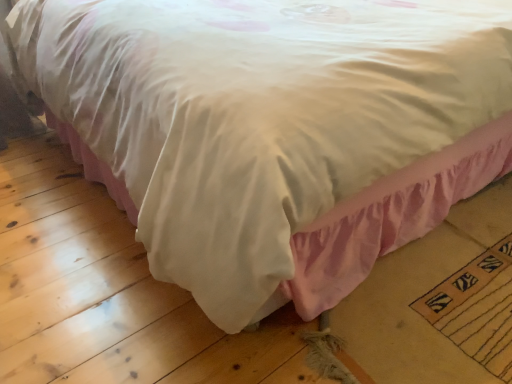
Describe the element at coordinates (477, 308) in the screenshot. I see `yellow woven mat at lower right` at that location.

Locate an element on the screen. The width and height of the screenshot is (512, 384). yellow woven mat at lower right is located at coordinates (477, 308).

Locate an element on the screen. The width and height of the screenshot is (512, 384). yellow woven mat at lower right is located at coordinates (477, 308).